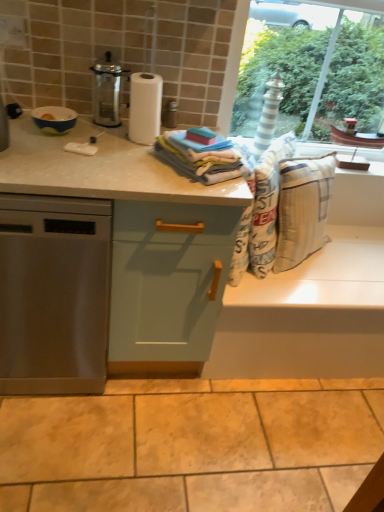
Locate an element on the screen. free space above stainless steel dishwasher at left (from a real-world perspective) is located at coordinates (37, 155).